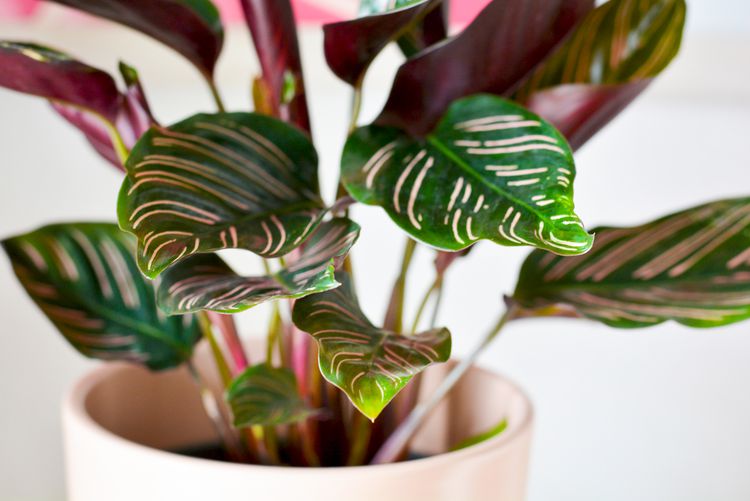
At what (x,y) coordinates should I click in order to perform the action: click on planter. Please return your answer as a coordinate pair (x, y). Looking at the image, I should click on (493, 476).